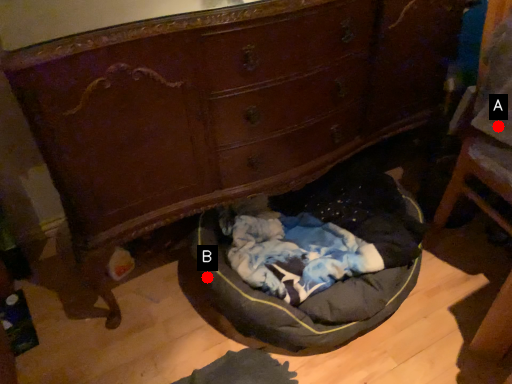
Question: Two points are circled on the image, labeled by A and B beside each circle. Which point is closer to the camera taking this photo?

Choices:
 (A) A is closer
 (B) B is closer

Answer: (A)